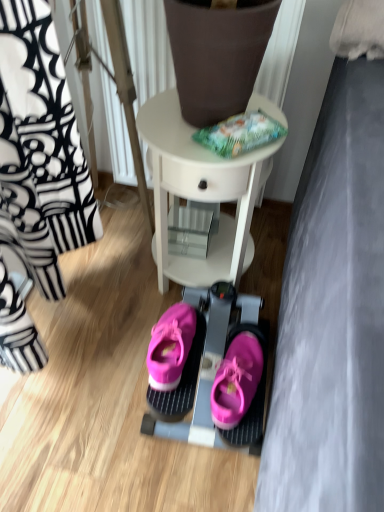
This screenshot has width=384, height=512. In order to click on free space in front of pink fabric sneakers at center in this screenshot , I will do `click(172, 480)`.